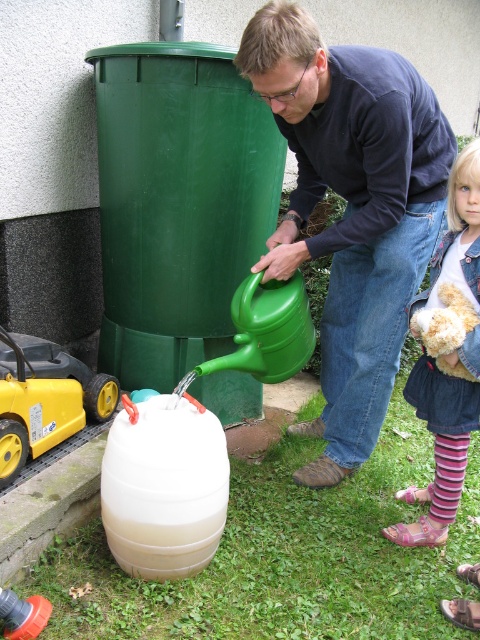
Is denim jacket at lower right shorter than yellow plastic toy at lower left?

No.

How far apart are denim jacket at lower right and yellow plastic toy at lower left?

1.41 meters

Does point (432, 504) lie in front of point (24, 394)?

No.

The height and width of the screenshot is (640, 480). I want to click on denim jacket at lower right, so click(442, 436).

Does denim jacket at lower right appear on the left side of fuzzy beige teddy bear at lower right?

Incorrect, denim jacket at lower right is not on the left side of fuzzy beige teddy bear at lower right.

Can you confirm if denim jacket at lower right is smaller than fuzzy beige teddy bear at lower right?

Actually, denim jacket at lower right might be larger than fuzzy beige teddy bear at lower right.

The height and width of the screenshot is (640, 480). Identify the location of denim jacket at lower right. (442, 436).

Does point (108, 522) lie behind point (475, 225)?

No, it is not.

Does point (127, 426) lie in front of point (405, 490)?

Yes, it is in front of point (405, 490).

Is point (208, 451) positioned in front of point (476, 369)?

Yes, point (208, 451) is in front of point (476, 369).

The width and height of the screenshot is (480, 640). In order to click on translucent plastic barrel at lower center in this screenshot , I will do click(164, 486).